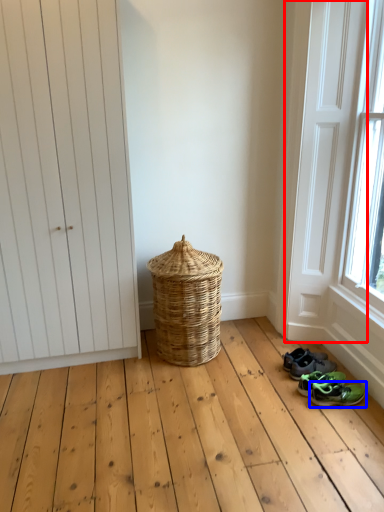
Question: Which object appears farthest to the camera in this image, screen door (highlighted by a red box) or footwear (highlighted by a blue box)?

Choices:
 (A) screen door
 (B) footwear

Answer: (B)